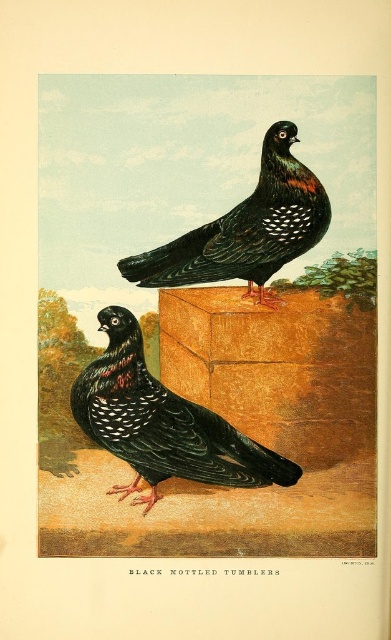
You are a birdwatcher observing two birds in the image. You notice both are labeled as black glossy tumbler at upper center and black speckled pigeon at upper center. Which one is closer to you?

The black glossy tumbler at upper center is closer to you since it is only 11.10 centimeters away from the black speckled pigeon at upper center, and since it is in the foreground, it would be nearer than the background bird.

You are a birdwatcher trying to identify pigeons in the image. There is a point marked at coordinates [161,422]. What is located at this point?

The point at [161,422] is where the black speckled pigeon at center is located.

Looking at this image, you are a birdwatcher observing the two black speckled pigeons in the scene. Which pigeon, the black speckled pigeon at center or the black speckled pigeon at upper center, appears to have a larger width when viewed from your perspective?

The black speckled pigeon at center might be wider than the black speckled pigeon at upper center according to the description.